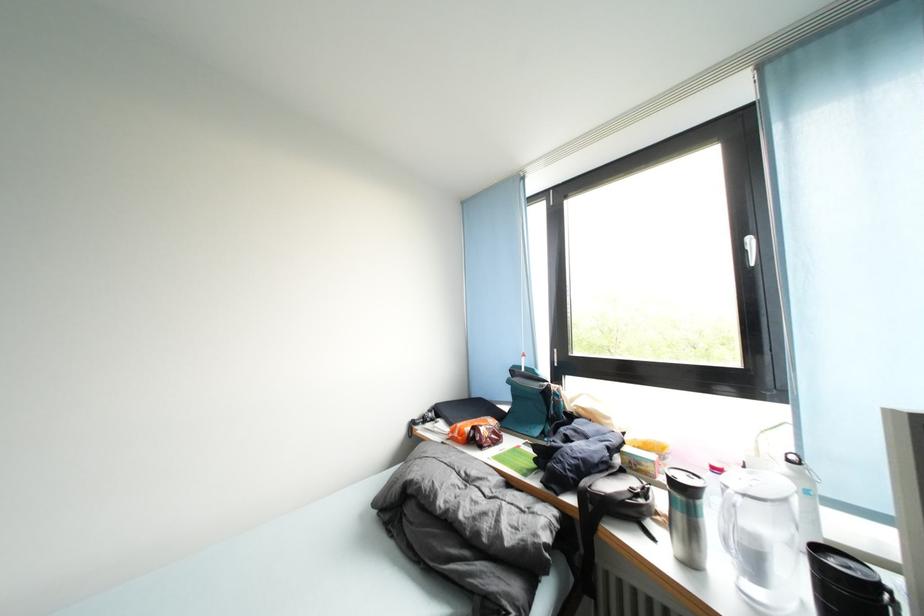
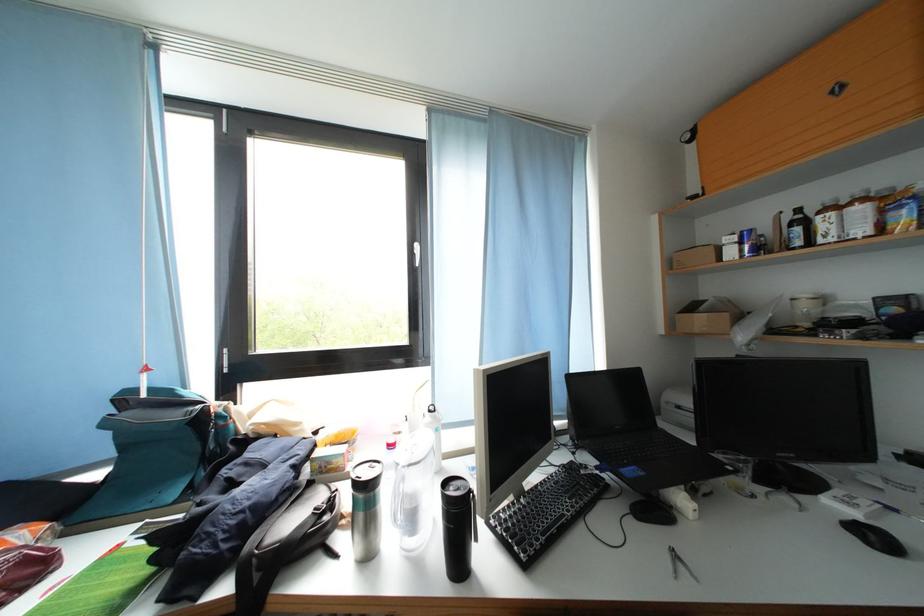
Where in the second image is the point corresponding to pixel 517 387 from the first image?

(114, 429)